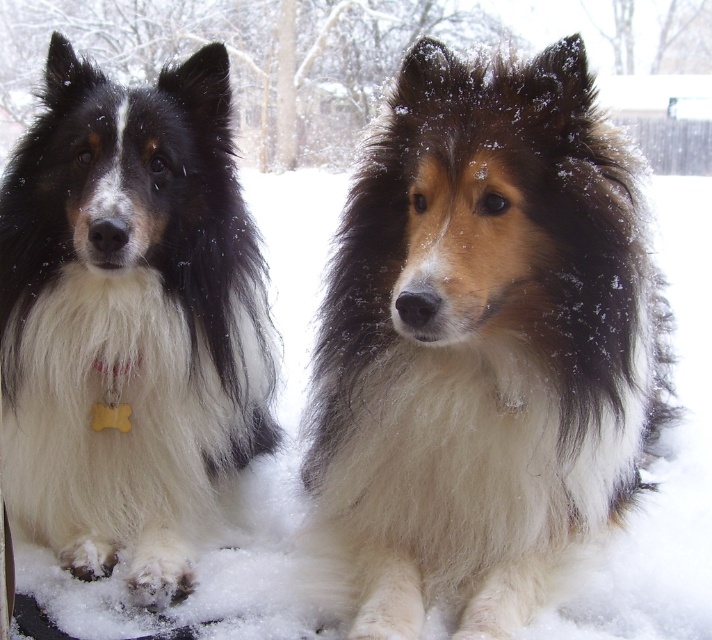
Question: Which object is farther from the camera taking this photo?

Choices:
 (A) fluffy white dog at center
 (B) fluffy white dog at left

Answer: (B)

Question: Is the position of fluffy white dog at center more distant than that of fluffy white dog at left?

Choices:
 (A) yes
 (B) no

Answer: (B)

Question: Which point appears farthest from the camera in this image?

Choices:
 (A) (446, 212)
 (B) (187, 385)

Answer: (B)

Question: Is fluffy white dog at center to the right of fluffy white dog at left from the viewer's perspective?

Choices:
 (A) no
 (B) yes

Answer: (B)

Question: Is fluffy white dog at center in front of fluffy white dog at left?

Choices:
 (A) yes
 (B) no

Answer: (A)